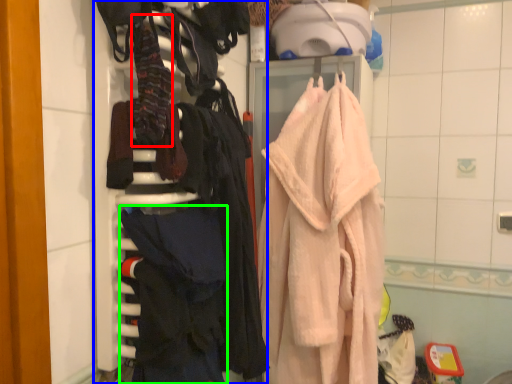
Question: Based on their relative distances, which object is nearer to clothing (highlighted by a red box)? Choose from closet (highlighted by a blue box) and clothing (highlighted by a green box).

Choices:
 (A) closet
 (B) clothing

Answer: (A)